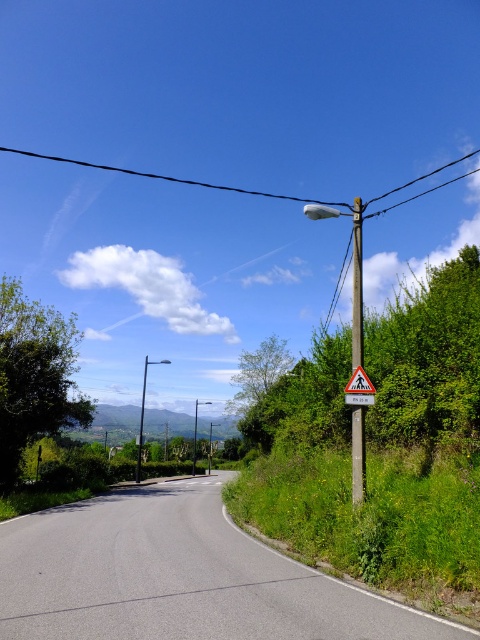
You are a GUI agent. You are given a task and a screenshot of the screen. Output one action in this format:
    pyautogui.click(x=<x>, y=<y>)
    Task: Click on the metallic gray pole at upper right
    The height and width of the screenshot is (640, 480).
    Given the screenshot: What is the action you would take?
    pyautogui.click(x=357, y=288)

Does metallic gray pole at upper right have a lesser height compared to yellow plastic pedestrian crossing sign at upper right?

No, metallic gray pole at upper right is not shorter than yellow plastic pedestrian crossing sign at upper right.

Does point (359, 445) lie in front of point (352, 396)?

Yes, point (359, 445) is in front of point (352, 396).

Identify the location of metallic gray pole at upper right. (357, 288).

Is point (137, 173) closer to camera compared to point (372, 401)?

No, (137, 173) is further to viewer.

Does black wire at upper center have a lesser width compared to yellow plastic pedestrian crossing sign at upper right?

Incorrect, black wire at upper center's width is not less than yellow plastic pedestrian crossing sign at upper right's.

Which is in front, point (287, 196) or point (348, 381)?

Point (348, 381) is more forward.

This screenshot has width=480, height=640. What are the coordinates of `black wire at upper center` in the screenshot? It's located at [169, 177].

Can you confirm if metallic gray pole at upper right is bigger than black wire at upper center?

No, metallic gray pole at upper right is not bigger than black wire at upper center.

Can you confirm if metallic gray pole at upper right is taller than black wire at upper center?

No, metallic gray pole at upper right is not taller than black wire at upper center.

Does point (357, 420) lie in front of point (385, 195)?

Yes, it is in front of point (385, 195).

You are a GUI agent. You are given a task and a screenshot of the screen. Output one action in this format:
    pyautogui.click(x=<x>, y=<y>)
    Task: Click on the metallic gray pole at upper right
    The image size is (480, 640).
    Given the screenshot: What is the action you would take?
    pyautogui.click(x=357, y=288)